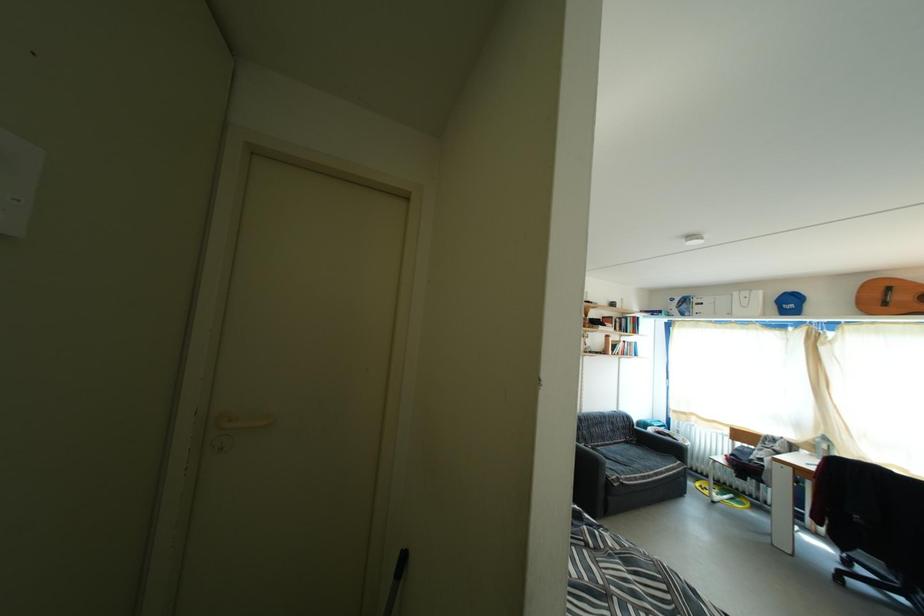
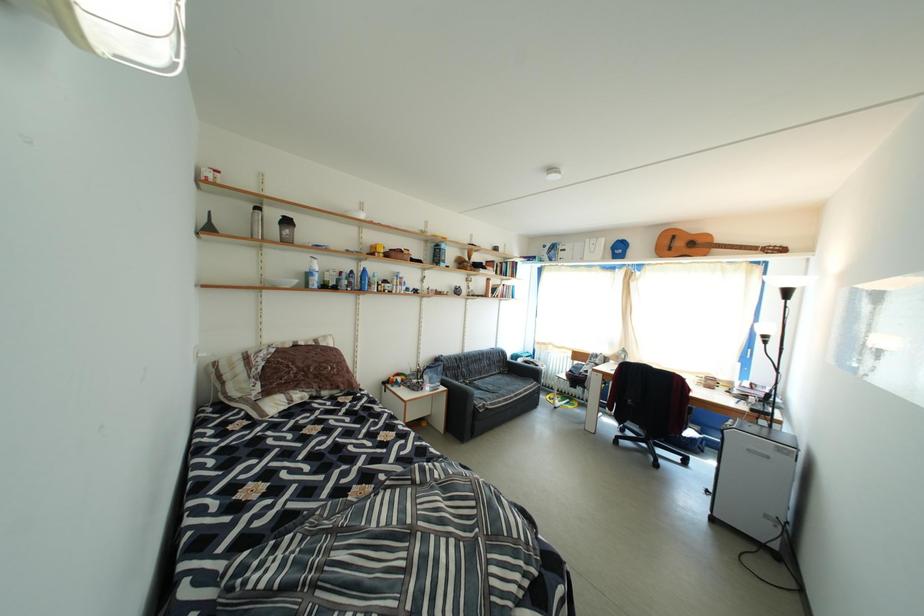
Question: The images are taken continuously from a first-person perspective. In which direction is your viewpoint rotating?

Choices:
 (A) Left
 (B) Right
 (C) Up
 (D) Down

Answer: (B)